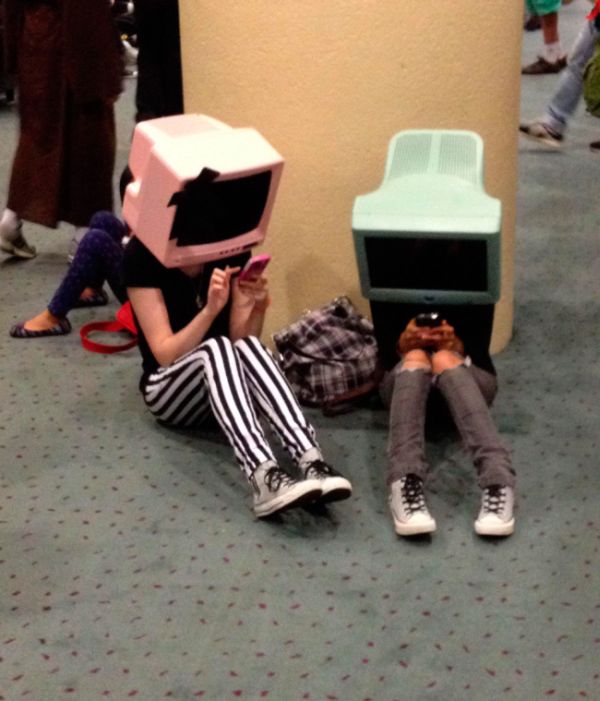
Identify the location of 3 colors in carpet. The height and width of the screenshot is (701, 600). (350, 659), (365, 662), (407, 646).